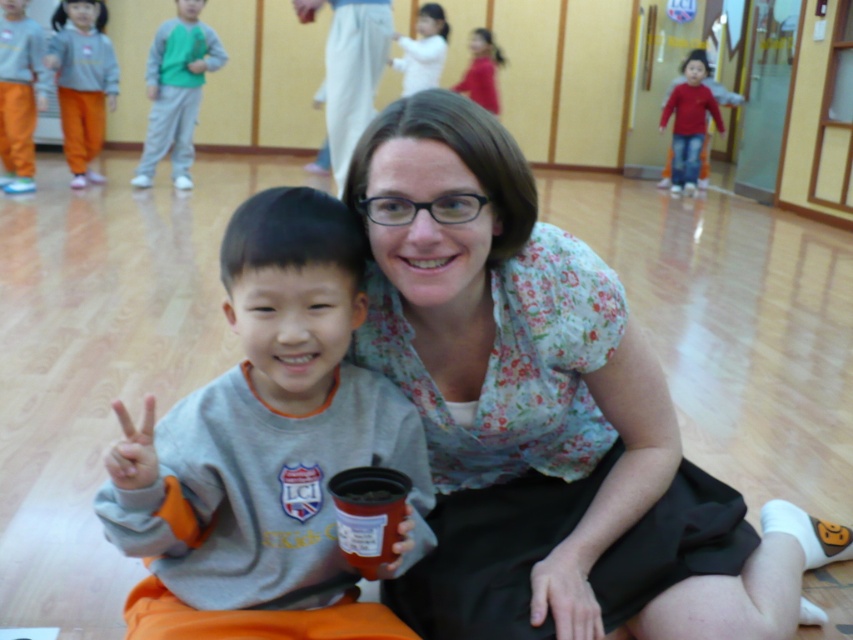
What do you see at coordinates (267, 448) in the screenshot? This screenshot has height=640, width=853. I see `gray fleece sweatshirt at left` at bounding box center [267, 448].

Describe the element at coordinates (267, 448) in the screenshot. This screenshot has width=853, height=640. I see `gray fleece sweatshirt at left` at that location.

The height and width of the screenshot is (640, 853). I want to click on gray fleece sweatshirt at left, so click(x=267, y=448).

Is floral fabric blouse at center positioned before green fabric shirt at upper left?

Yes.

Does floral fabric blouse at center have a greater height compared to green fabric shirt at upper left?

No, floral fabric blouse at center is not taller than green fabric shirt at upper left.

Describe the element at coordinates (537, 412) in the screenshot. I see `floral fabric blouse at center` at that location.

Where is `floral fabric blouse at center`? floral fabric blouse at center is located at coordinates (537, 412).

Can you confirm if green fabric shirt at upper left is positioned below orange cotton pants at left?

Yes.

Does green fabric shirt at upper left appear on the left side of orange cotton pants at left?

Incorrect, green fabric shirt at upper left is not on the left side of orange cotton pants at left.

Is point (184, 72) behind point (86, 106)?

No, it is in front of (86, 106).

Locate an element on the screen. This screenshot has height=640, width=853. green fabric shirt at upper left is located at coordinates (177, 90).